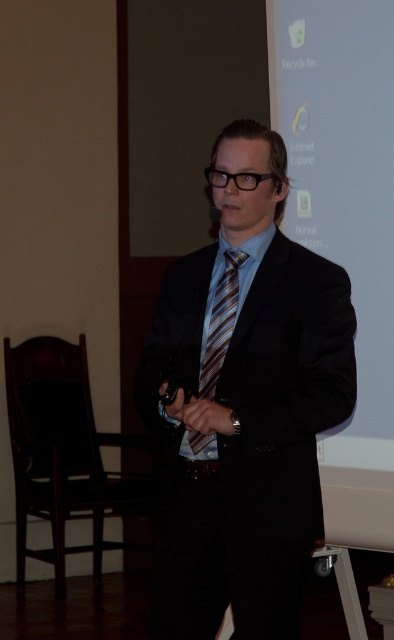
In the scene shown: You are an event coordinator planning to adjust the lighting for a presentation. The speaker is wearing a matte black suit at center and a brown striped tie at center. Which clothing item is closer to the top of the speaker? Please answer based on their positions.

The brown striped tie at center is closer to the top of the speaker because the matte black suit at center is positioned under it.

You are an attendee at a presentation. You notice the white matte projection screen at upper center and the brown striped tie at center. Which object is positioned higher in the image?

The white matte projection screen at upper center is positioned higher than the brown striped tie at center.

You are an attendee at a conference and notice the speaker wearing a matte black suit at center and a white matte projection screen at upper center. Which object is positioned higher in the image?

The white matte projection screen at upper center is positioned higher in the image than the matte black suit at center.